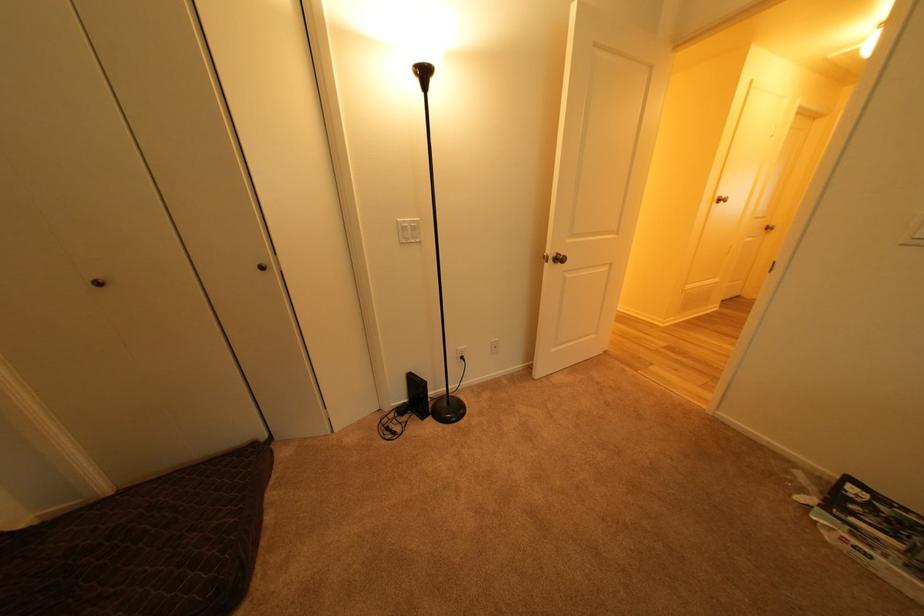
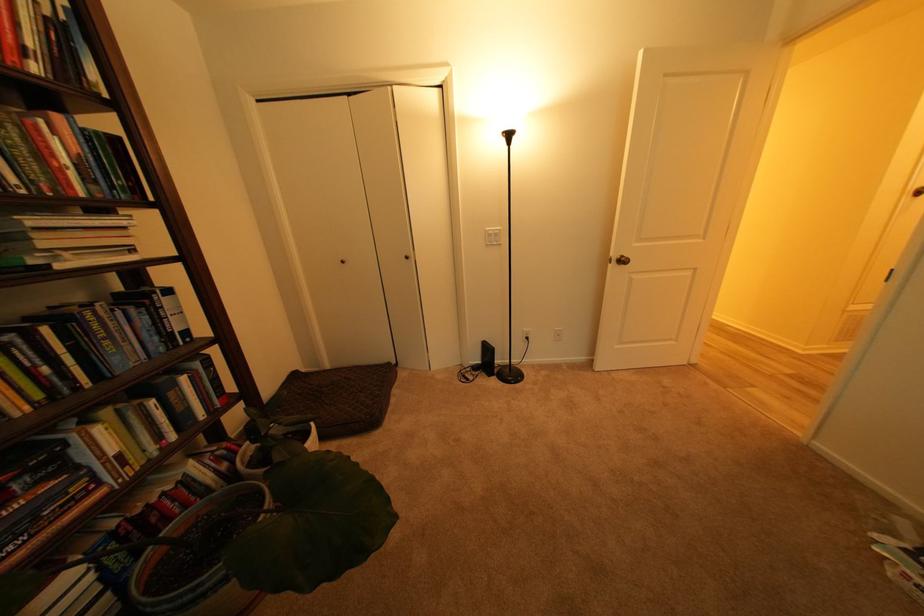
Question: The camera is either moving clockwise (left) or counter-clockwise (right) around the object. The first image is from the beginning of the video and the second image is from the end. Is the camera moving left or right when shooting the video?

Choices:
 (A) Left
 (B) Right

Answer: (B)